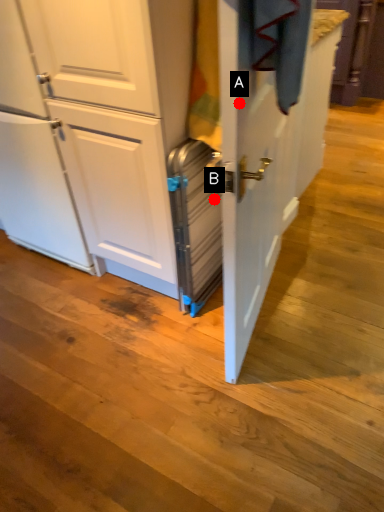
Question: Two points are circled on the image, labeled by A and B beside each circle. Which point is closer to the camera?

Choices:
 (A) A is closer
 (B) B is closer

Answer: (A)